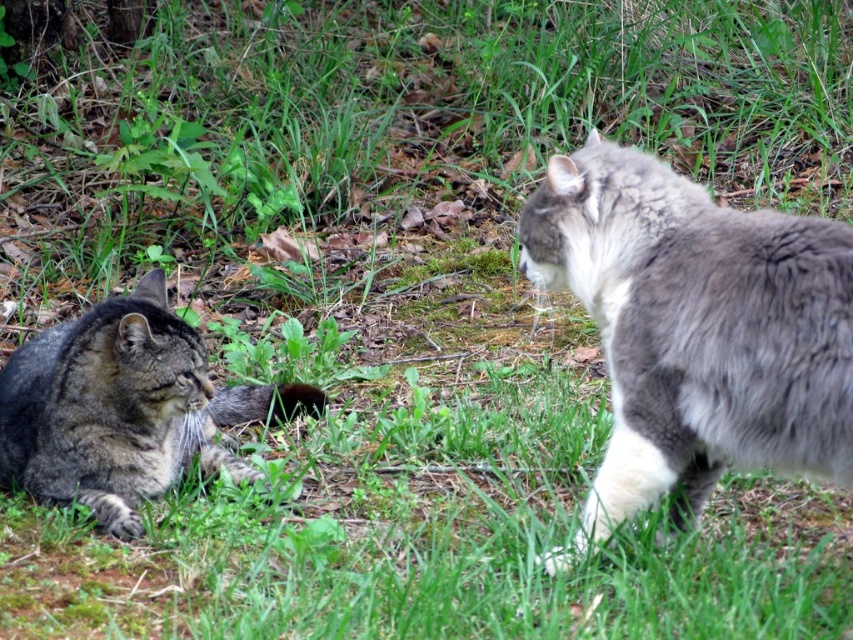
Between gray fluffy cat at right and tabby fur cat at left, which one appears on the right side from the viewer's perspective?

gray fluffy cat at right

Does gray fluffy cat at right appear on the right side of tabby fur cat at left?

Correct, you'll find gray fluffy cat at right to the right of tabby fur cat at left.

The image size is (853, 640). Identify the location of gray fluffy cat at right. [x=695, y=328].